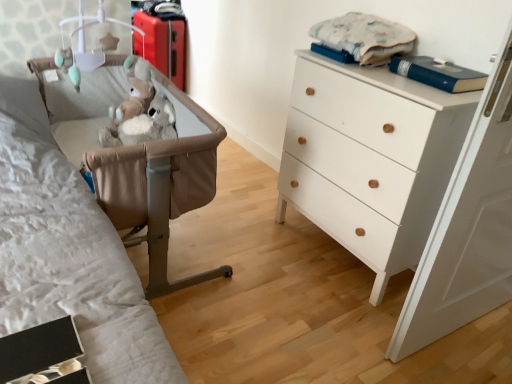
Where is `free space in front of blue hardcover book at upper right`? Image resolution: width=512 pixels, height=384 pixels. free space in front of blue hardcover book at upper right is located at coordinates (439, 91).